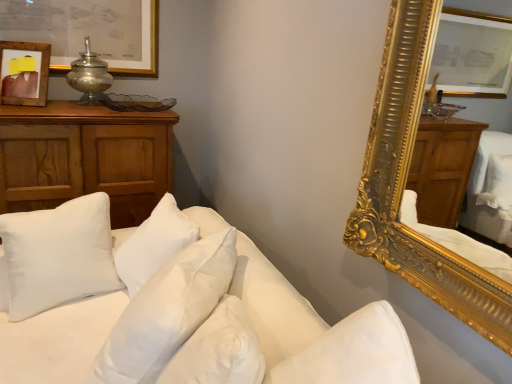
Question: Is point (92, 87) positioned closer to the camera than point (139, 347)?

Choices:
 (A) farther
 (B) closer

Answer: (A)

Question: In the image, is metallic silver table lamp at upper left positioned in front of or behind white soft pillows at lower left?

Choices:
 (A) behind
 (B) front

Answer: (A)

Question: Estimate the real-world distances between objects in this image. Which object is closer to the wooden picture frame at upper left?

Choices:
 (A) wooden cabinet at left
 (B) white soft pillows at lower left
 (C) white soft pillow at center, the second pillow in the left-to-right sequence
 (D) metallic silver table lamp at upper left
 (E) white soft pillow at left, arranged as the 2th pillow when viewed from the front

Answer: (D)

Question: Which is farther from the white soft pillows at lower left?

Choices:
 (A) white soft pillow at center, the first pillow in the front-to-back sequence
 (B) metallic silver table lamp at upper left
 (C) wooden picture frame at upper left
 (D) wooden cabinet at left
 (E) white soft pillow at left, which appears as the second pillow when viewed from the right

Answer: (B)